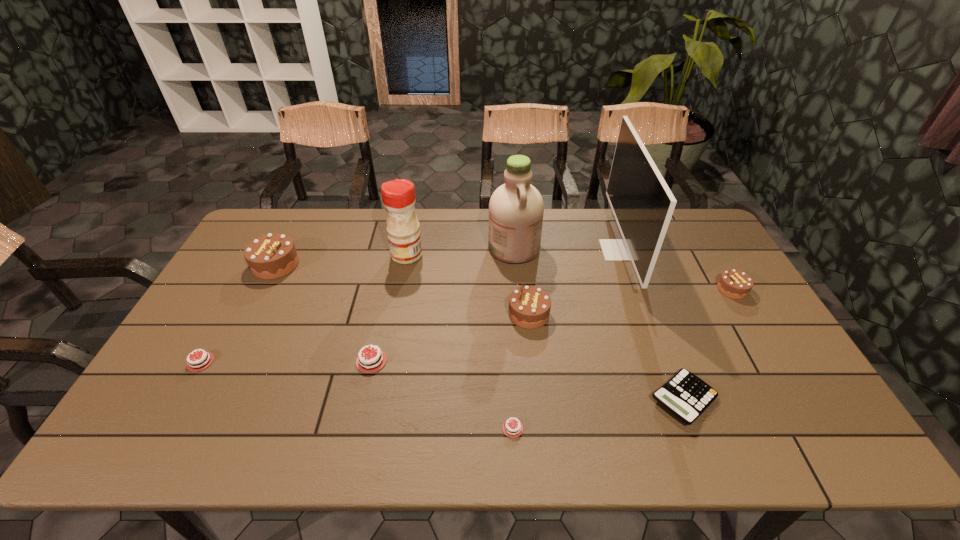
This screenshot has width=960, height=540. Find the location of `free spot located on the front label of the cleansing agent`. free spot located on the front label of the cleansing agent is located at coordinates (410, 248).

What are the coordinates of `free spot located on the front label of the cleansing agent` in the screenshot? It's located at (433, 248).

This screenshot has width=960, height=540. What are the coordinates of `vacant point located 0.330m on the front label of the cleansing agent` in the screenshot? It's located at (392, 248).

You are a GUI agent. You are given a task and a screenshot of the screen. Output one action in this format:
    pyautogui.click(x=<x>, y=<y>)
    Task: Click on the free region located 0.130m on the left of the third tallest object
    
    Given the screenshot: What is the action you would take?
    pyautogui.click(x=352, y=255)

Locate an element on the screen. The height and width of the screenshot is (540, 960). vacant space situated 0.170m on the right of the leftmost brown chocolate cake is located at coordinates (350, 265).

I want to click on free location located 0.060m on the front of the second biggest brown chocolate cake, so click(x=532, y=347).

Where is `vacant space located on the front of the third tallest chocolate cake`? This screenshot has width=960, height=540. vacant space located on the front of the third tallest chocolate cake is located at coordinates (776, 362).

The width and height of the screenshot is (960, 540). In order to click on free region located on the back of the seventh tallest object in this screenshot , I will do `click(387, 292)`.

At what (x,y) coordinates should I click in order to perform the action: click on free spot located on the back of the second biggest red chocolate cake. Please return your answer as a coordinate pair (x, y). Looking at the image, I should click on (246, 282).

I want to click on free space located 0.170m on the right of the calculator, so click(786, 399).